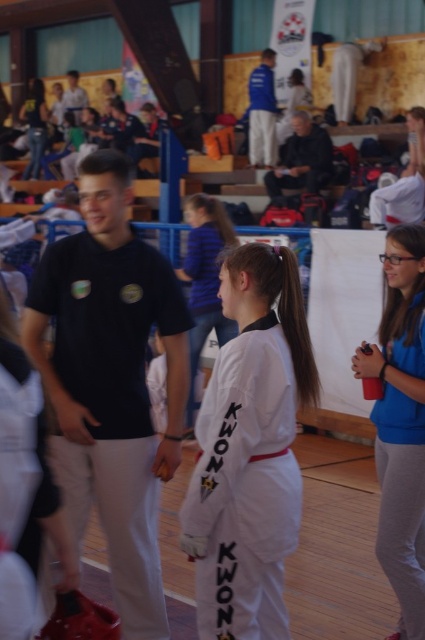
You are a photographer at the event and want to take a photo that includes both the white matte karate uniform at center and the blue fabric shirt at right. Based on their positions, which one should you place on the left side of the photo to ensure both are visible?

To include both the white matte karate uniform at center and the blue fabric shirt at right in the photo, you should place the white matte karate uniform at center on the left side since it is already positioned to the left of the blue fabric shirt at right.

You are standing at the entrance of the gymnasium and see the white matte karate uniform at center. If you walk straight ahead, will you pass by the uniform first before reaching the bleachers in the background?

The white matte karate uniform at center is positioned at point (249, 451), which is closer to the front of the image compared to the bleachers in the background. Therefore, walking straight ahead, you would pass by the white matte karate uniform at center before reaching the bleachers.

You are a photographer setting up for a martial arts event. You see a blue fabric shirt at right and a matte black karate uniform at upper left. Which object is closer to the bottom of the image?

The blue fabric shirt at right is positioned under the matte black karate uniform at upper left, so it is closer to the bottom of the image.